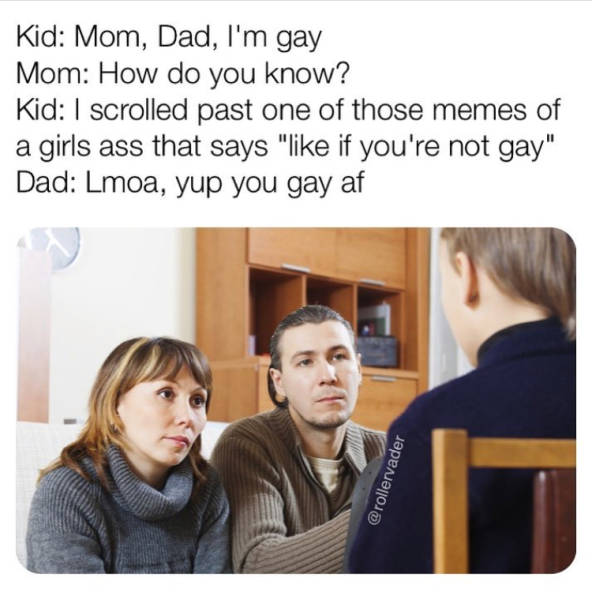
This screenshot has width=592, height=600. Find the location of `furniture`. furniture is located at coordinates (284, 241), (30, 432), (482, 455), (28, 328).